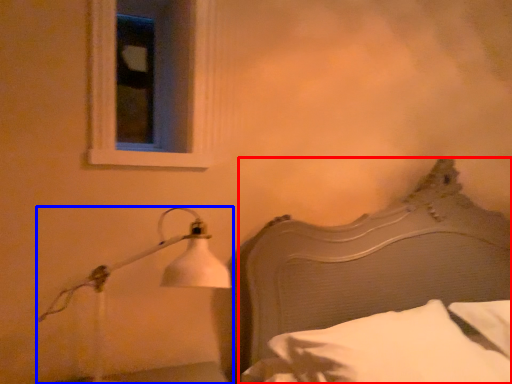
Question: Which point is further to the camera, bed (highlighted by a red box) or lamp (highlighted by a blue box)?

Choices:
 (A) bed
 (B) lamp

Answer: (B)